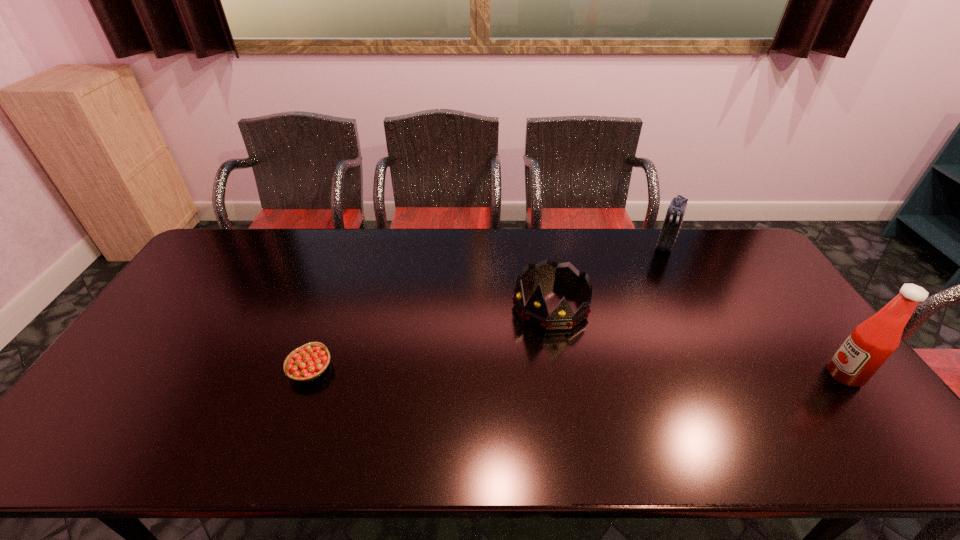
Where is `strawberry`? This screenshot has width=960, height=540. strawberry is located at coordinates (306, 363).

Where is `the leftmost object`? Image resolution: width=960 pixels, height=540 pixels. the leftmost object is located at coordinates (306, 363).

Image resolution: width=960 pixels, height=540 pixels. In order to click on the rightmost object in this screenshot , I will do `click(871, 343)`.

I want to click on condiment, so pos(871,343).

Locate an element on the screen. The height and width of the screenshot is (540, 960). the farthest object is located at coordinates (675, 213).

Identify the location of the third object from left to right. (675, 213).

Identify the location of the second farthest object. (535, 312).

At what (x,y) coordinates should I click in order to perform the action: click on tiara. Please return your answer as a coordinate pair (x, y). The width and height of the screenshot is (960, 540). Looking at the image, I should click on (535, 312).

This screenshot has width=960, height=540. I want to click on vacant region located on the right of the leftmost object, so click(377, 369).

The image size is (960, 540). Find the location of `vacant space located on the front-facing side of the condiment`. vacant space located on the front-facing side of the condiment is located at coordinates (771, 375).